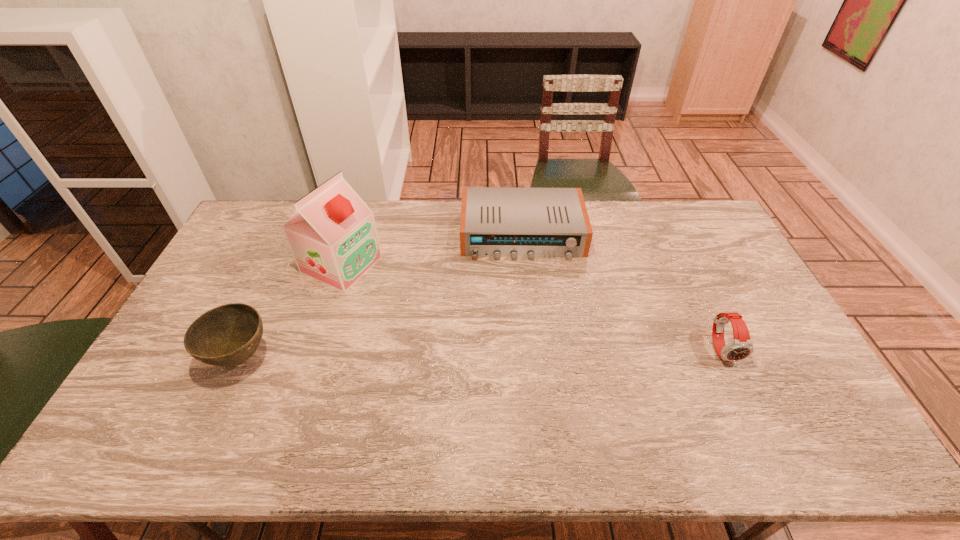
Image resolution: width=960 pixels, height=540 pixels. What are the coordinates of `vacant point located between the tallest object and the rightmost object` in the screenshot? It's located at (532, 307).

Locate an element on the screen. empty location between the radio receiver and the bowl is located at coordinates (381, 296).

At what (x,y) coordinates should I click in order to perform the action: click on unoccupied area between the watch and the radio receiver. Please return your answer as a coordinate pair (x, y). Looking at the image, I should click on (622, 292).

The height and width of the screenshot is (540, 960). I want to click on vacant area that lies between the soya milk and the rightmost object, so click(532, 307).

Find the location of a particular element. This screenshot has width=960, height=540. the third closest object to the shortest object is located at coordinates (228, 335).

Locate which object is the closest to the tallest object. Please provide its 2D coordinates. Your answer should be formatted as a tuple, i.e. [(x, y)], where the tuple contains the x and y coordinates of a point satisfying the conditions above.

[(228, 335)]